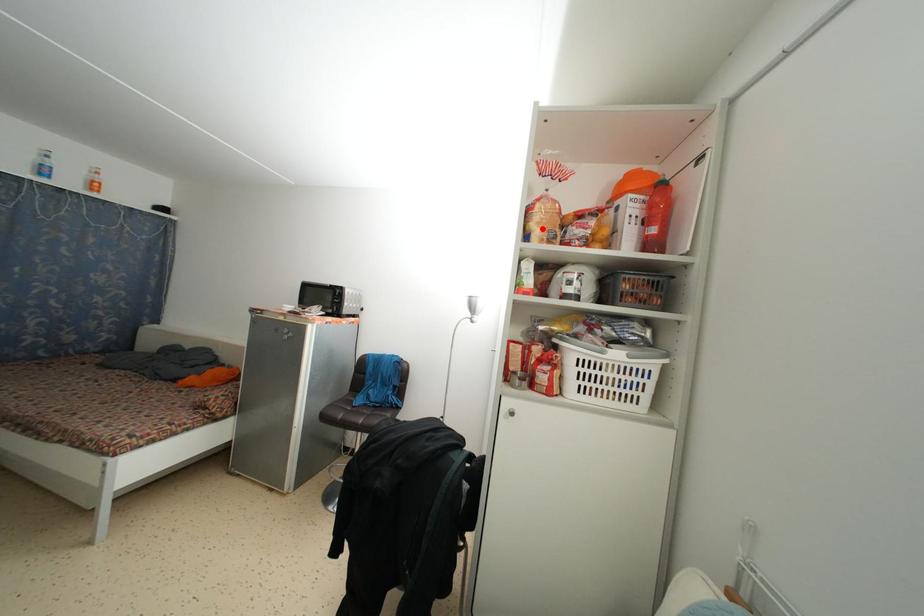
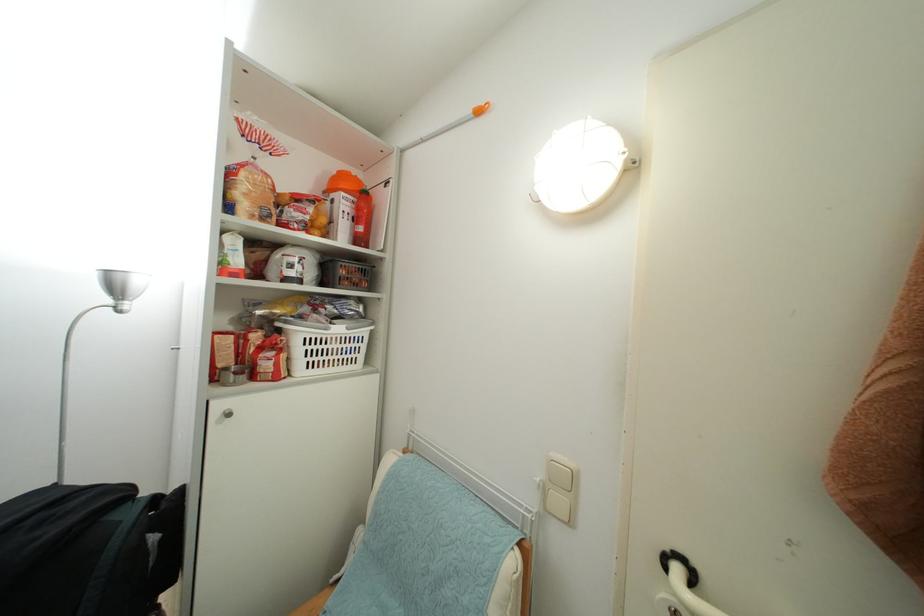
Find the pixel in the second image that matches the highlighted location in the first image.

(249, 200)